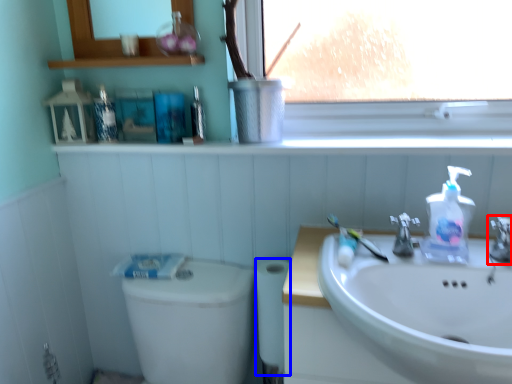
Question: Which point is further to the camera, tap (highlighted by a red box) or toilet paper (highlighted by a blue box)?

Choices:
 (A) tap
 (B) toilet paper

Answer: (B)